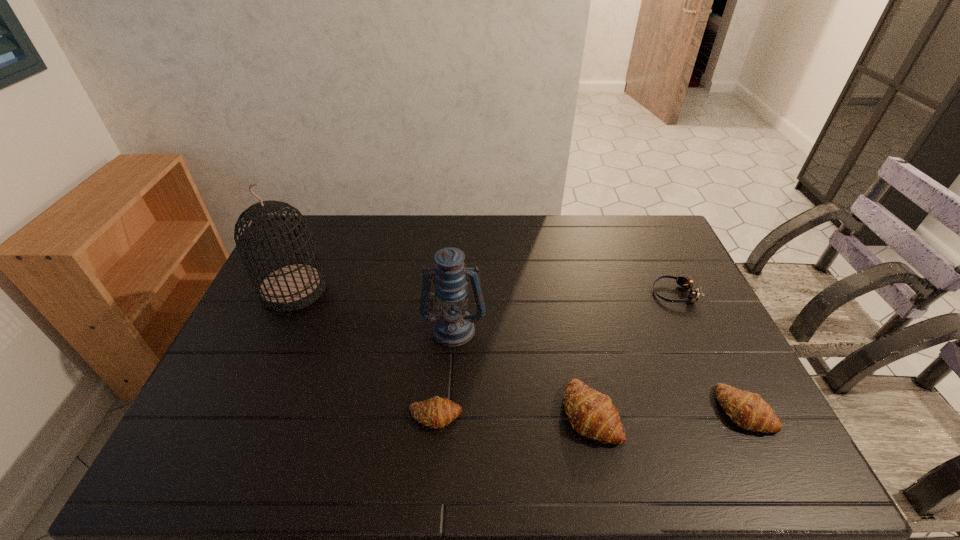
Where is `object positioned at the near right corner`? object positioned at the near right corner is located at coordinates (748, 410).

In the image, there is a desktop. Where is `vacant space at the far edge`? The height and width of the screenshot is (540, 960). vacant space at the far edge is located at coordinates (593, 223).

Where is `vacant space at the near edge of the desktop`? The height and width of the screenshot is (540, 960). vacant space at the near edge of the desktop is located at coordinates (643, 411).

In the image, there is a desktop. What are the coordinates of `free space at the left edge` in the screenshot? It's located at (272, 360).

In the image, there is a desktop. Identify the location of vacant space at the right edge. This screenshot has width=960, height=540. (681, 320).

I want to click on vacant space at the far left corner, so click(331, 215).

Find the location of a particular element. The image size is (960, 540). free space that is in between the lantern and the third object from right to left is located at coordinates (522, 370).

Locate an element on the screen. vacant area that lies between the goggles and the fourth tallest object is located at coordinates (709, 352).

Where is `unoccupied position between the second crescent roll from left to right and the shortest crescent roll`? This screenshot has width=960, height=540. unoccupied position between the second crescent roll from left to right and the shortest crescent roll is located at coordinates (513, 414).

Find the location of `free space between the birdcage and the goggles`. free space between the birdcage and the goggles is located at coordinates (484, 291).